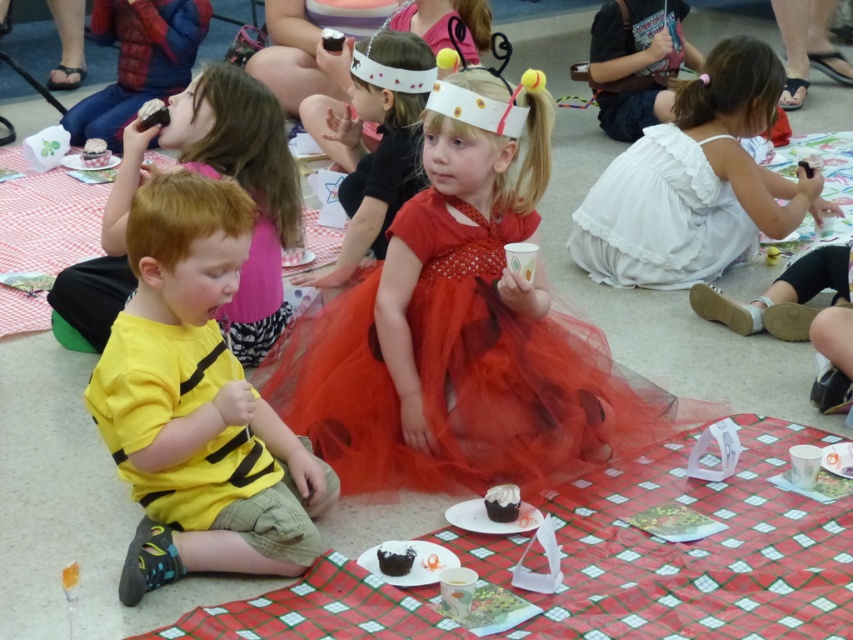
Does point (674, 284) come behind point (376, 208)?

Yes, point (674, 284) is farther from viewer.

Locate an element on the screen. Image resolution: width=853 pixels, height=640 pixels. white cotton dress at right is located at coordinates (660, 216).

Consider the image. Is the position of red checkered tablecloth at lower center less distant than that of white cotton dress at right?

Yes.

How much distance is there between red checkered tablecloth at lower center and white cotton dress at right?

red checkered tablecloth at lower center and white cotton dress at right are 4.54 feet apart from each other.

Where is `red checkered tablecloth at lower center`? red checkered tablecloth at lower center is located at coordinates (700, 552).

Consider the image. Does white cotton dress at center have a greater width compared to chocolate cake at center?

Yes, white cotton dress at center is wider than chocolate cake at center.

Can you confirm if white cotton dress at center is bigger than chocolate cake at center?

Indeed, white cotton dress at center has a larger size compared to chocolate cake at center.

Between point (747, 129) and point (396, 544), which one is positioned behind?

The point (747, 129) is more distant.

Locate an element on the screen. The width and height of the screenshot is (853, 640). white cotton dress at center is located at coordinates (695, 182).